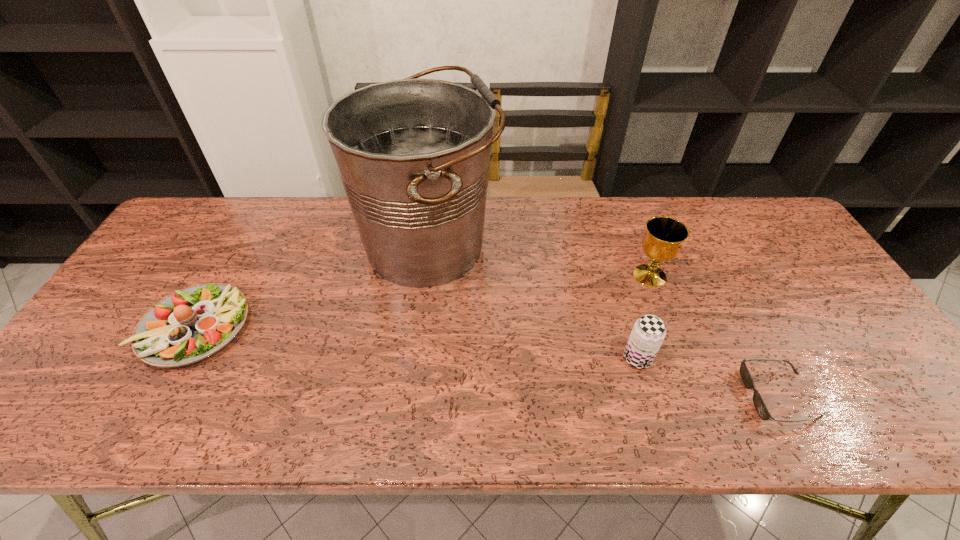
Image resolution: width=960 pixels, height=540 pixels. Identify the location of free space at the far edge of the desktop. [528, 242].

Where is `free space at the near edge`? This screenshot has width=960, height=540. free space at the near edge is located at coordinates (525, 403).

Find the location of `vacant space at the left edge of the desktop`. vacant space at the left edge of the desktop is located at coordinates (145, 302).

Where is `free region at the right edge`? free region at the right edge is located at coordinates (796, 251).

In the image, there is a desktop. At what (x,y) coordinates should I click in order to perform the action: click on free space at the far right corner. Please return your answer as a coordinate pair (x, y). Looking at the image, I should click on (772, 219).

At what (x,y) coordinates should I click in order to perform the action: click on empty space between the leftmost object and the third shortest object. Please return your answer as a coordinate pair (x, y). This screenshot has height=540, width=960. Looking at the image, I should click on (417, 343).

Locate an element on the screen. vacant area between the leftmost object and the second tallest object is located at coordinates (422, 301).

You are a GUI agent. You are given a task and a screenshot of the screen. Output one action in this format:
    pyautogui.click(x=<x>, y=<y>)
    Task: Click on the vacant area between the chalice and the bucket
    
    Given the screenshot: What is the action you would take?
    pyautogui.click(x=540, y=260)

The image size is (960, 540). Identify the location of vacant area between the fourth object from right to left and the third tallest object. (533, 301).

This screenshot has height=540, width=960. Find the location of `empty space that is in between the salad plate and the third object from left to right`. empty space that is in between the salad plate and the third object from left to right is located at coordinates (417, 343).